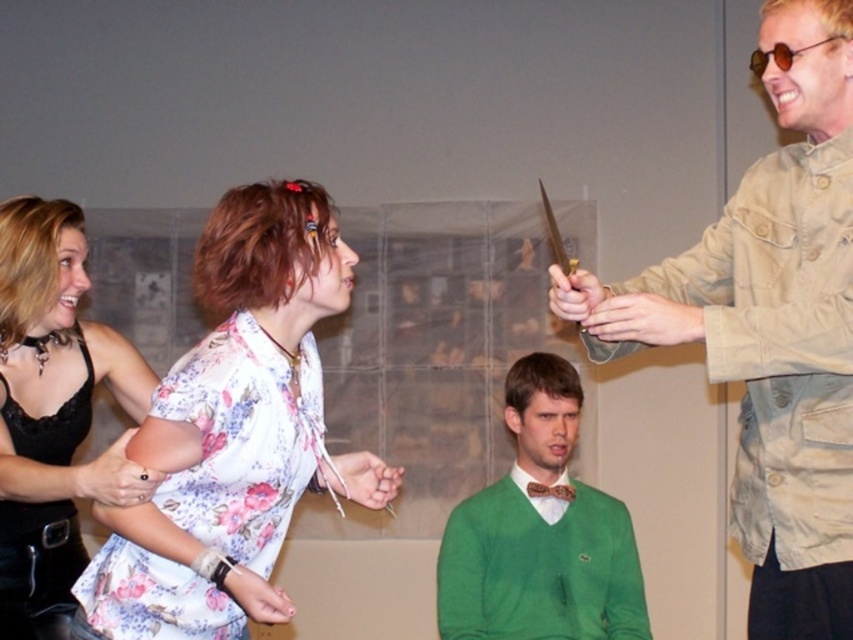
Can you confirm if tan canvas jacket at right is thinner than matte black leather jacket at left?

Yes, tan canvas jacket at right is thinner than matte black leather jacket at left.

In the scene shown: Which is below, tan canvas jacket at right or matte black leather jacket at left?

matte black leather jacket at left is lower down.

In order to click on tan canvas jacket at right in this screenshot , I will do `click(773, 326)`.

Is the position of matte black leather jacket at left more distant than that of green knit sweater at center?

No, it is in front of green knit sweater at center.

Who is more forward, (x=10, y=508) or (x=497, y=509)?

Point (x=10, y=508) is more forward.

Is point (33, 212) closer to viewer compared to point (461, 538)?

Yes, point (33, 212) is in front of point (461, 538).

Where is `matte black leather jacket at left`? This screenshot has width=853, height=640. matte black leather jacket at left is located at coordinates coord(53,413).

Describe the element at coordinates (773, 326) in the screenshot. This screenshot has width=853, height=640. I see `tan canvas jacket at right` at that location.

Find the location of a particular element. The height and width of the screenshot is (640, 853). tan canvas jacket at right is located at coordinates (773, 326).